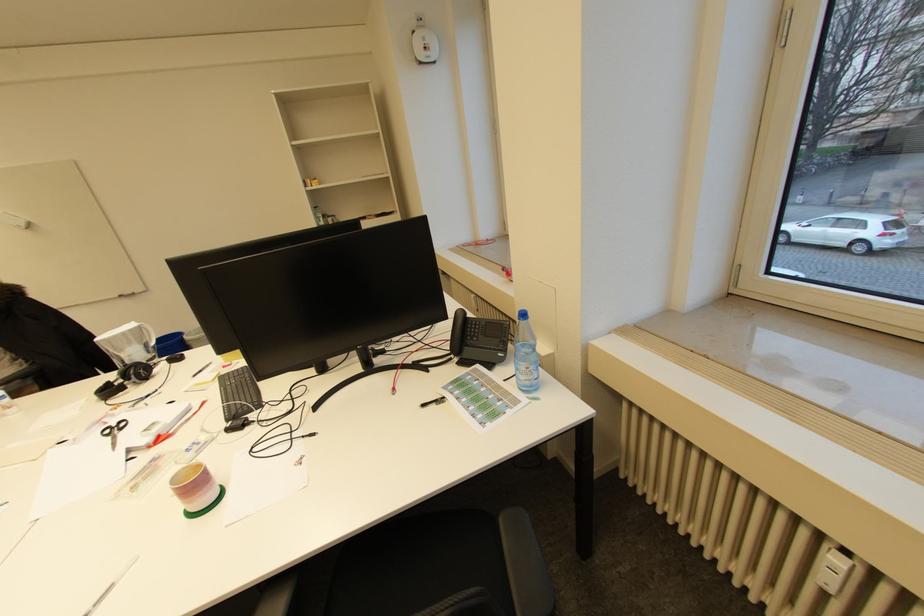
This screenshot has width=924, height=616. I want to click on chair sitting surface, so click(x=402, y=576).